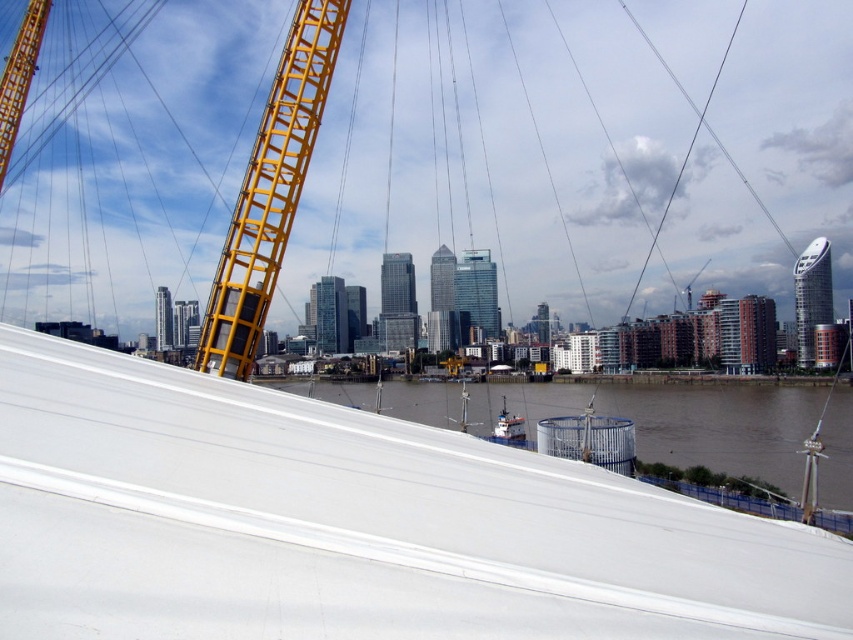
Does point (535, 420) come behind point (270, 280)?

Yes, it is behind point (270, 280).

Does brown matte water at lower center come behind yellow metallic structure at left?

No, brown matte water at lower center is in front of yellow metallic structure at left.

Locate an element on the screen. The height and width of the screenshot is (640, 853). brown matte water at lower center is located at coordinates (720, 426).

Does yellow metallic structure at left have a larger size compared to yellow metallic crane at upper left?

No.

Is yellow metallic structure at left to the right of yellow metallic crane at upper left from the viewer's perspective?

Indeed, yellow metallic structure at left is positioned on the right side of yellow metallic crane at upper left.

Does point (200, 333) lie behind point (28, 26)?

No, (200, 333) is closer to viewer.

Find the location of `yellow metallic structure at left`. yellow metallic structure at left is located at coordinates (270, 192).

Is brown matte water at lower center wider than yellow metallic crane at upper left?

Correct, the width of brown matte water at lower center exceeds that of yellow metallic crane at upper left.

Can you confirm if brown matte water at lower center is positioned below yellow metallic crane at upper left?

Correct, brown matte water at lower center is located below yellow metallic crane at upper left.

Is point (784, 468) farther from camera compared to point (30, 52)?

That is False.

Locate an element on the screen. The width and height of the screenshot is (853, 640). brown matte water at lower center is located at coordinates (720, 426).